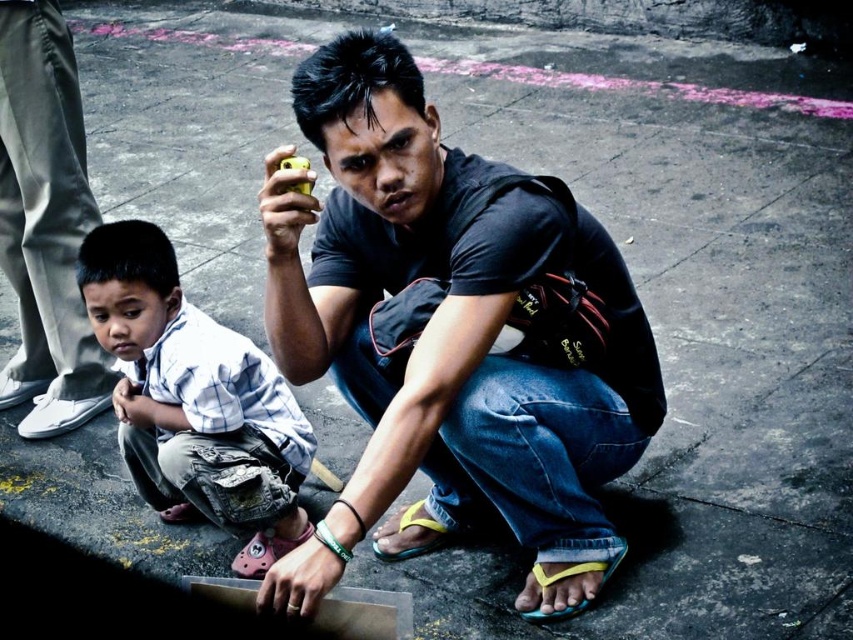
Question: Where is black matte shirt at center located in relation to matte black shirt at lower center in the image?

Choices:
 (A) left
 (B) right

Answer: (B)

Question: Can you confirm if white checkered shirt at lower left is smaller than matte black shirt at lower center?

Choices:
 (A) yes
 (B) no

Answer: (A)

Question: Based on their relative distances, which object is farther from the black matte shirt at center?

Choices:
 (A) white checkered shirt at lower left
 (B) matte black shirt at lower center

Answer: (B)

Question: Which point is closer to the camera?

Choices:
 (A) (387, 76)
 (B) (50, 304)

Answer: (A)

Question: Is the position of black matte shirt at center more distant than that of white checkered shirt at lower left?

Choices:
 (A) yes
 (B) no

Answer: (B)

Question: Based on their relative distances, which object is farther from the black matte shirt at center?

Choices:
 (A) white checkered shirt at lower left
 (B) matte black shirt at lower center

Answer: (B)